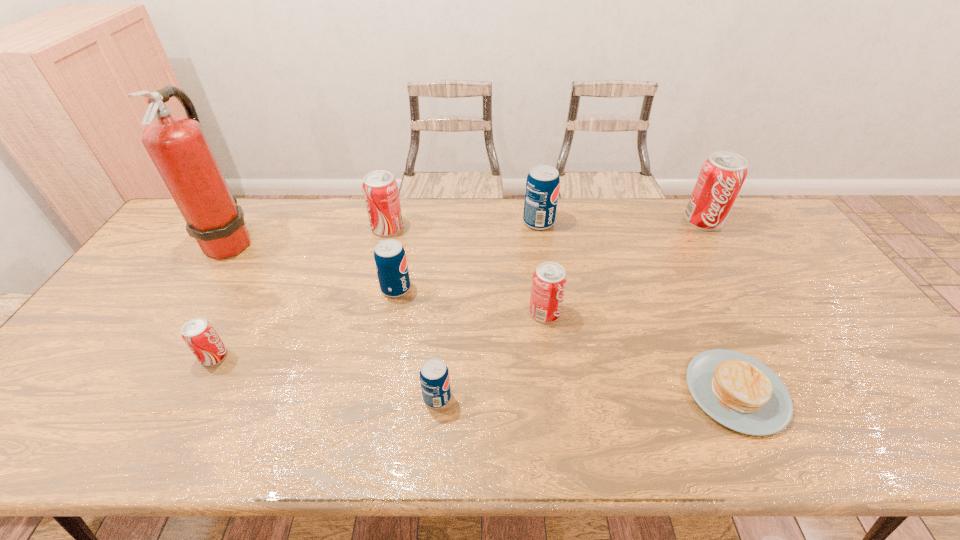
Identify the location of vacant region located on the back of the fourth farthest pop. (413, 201).

Find the location of `vacant space located on the left of the third biggest red soda can`. vacant space located on the left of the third biggest red soda can is located at coordinates (453, 313).

In order to click on free location located 0.220m on the right of the smallest red soda can in this screenshot , I will do 314,356.

At what (x,y) coordinates should I click in order to perform the action: click on vacant area located 0.230m on the back of the nearest blue pop. Please return your answer as a coordinate pair (x, y). The width and height of the screenshot is (960, 540). Looking at the image, I should click on (444, 313).

I want to click on vacant point located on the back of the pancake, so click(x=699, y=313).

Find the location of `fire extinguisher present at the far edge`. fire extinguisher present at the far edge is located at coordinates (178, 147).

You are a GUI agent. You are given a task and a screenshot of the screen. Output one action in this format:
    pyautogui.click(x=<x>, y=<y>)
    Task: Click on the object that is at the near edge
    
    Given the screenshot: What is the action you would take?
    pyautogui.click(x=738, y=391)

Image resolution: width=960 pixels, height=540 pixels. What are the coordinates of `object situated at the left edge` in the screenshot? It's located at point(178,147).

Where is `object present at the far left corner`? The height and width of the screenshot is (540, 960). object present at the far left corner is located at coordinates (178, 147).

Locate an element on the screen. The width and height of the screenshot is (960, 540). free spot at the far edge of the desktop is located at coordinates (518, 217).